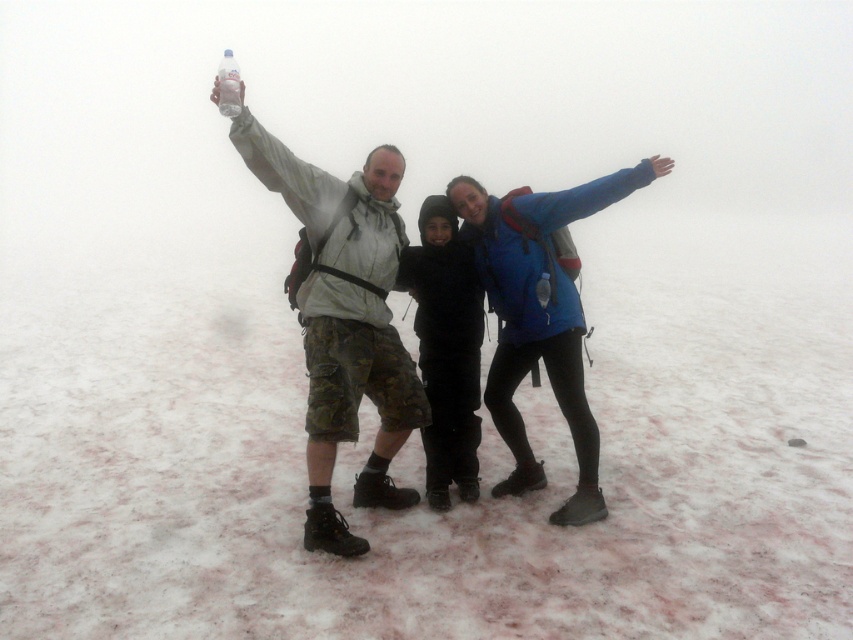
You are a photographer trying to capture both the matte gray jacket at center and the blue matte jacket at center in a single frame. Since the camera can only focus on one jacket at a time, which jacket should you focus on to ensure the taller one is in focus?

The matte gray jacket at center is taller than the blue matte jacket at center, so you should focus on the matte gray jacket at center to ensure the taller one is in focus.

You are a photographer trying to capture a photo of the white fluffy snow at center and the matte gray jacket at center. Which object should you focus on first if you want to ensure both are in focus, given that the camera can only focus on one object at a time?

The white fluffy snow at center is positioned on the right side of matte gray jacket at center, so focusing on the matte gray jacket at center first would ensure both are in focus since it is closer to the camera.